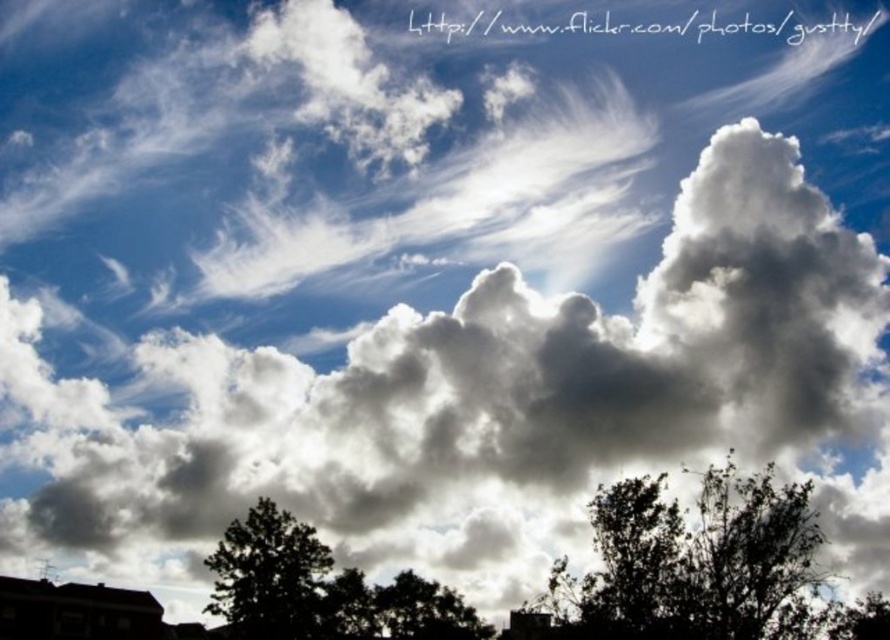
You are standing in a field and see the dark green leafy tree at lower left and the green leafy tree at lower right. Which tree is closer to the ground?

The dark green leafy tree at lower left is located below the green leafy tree at lower right, so it is closer to the ground.